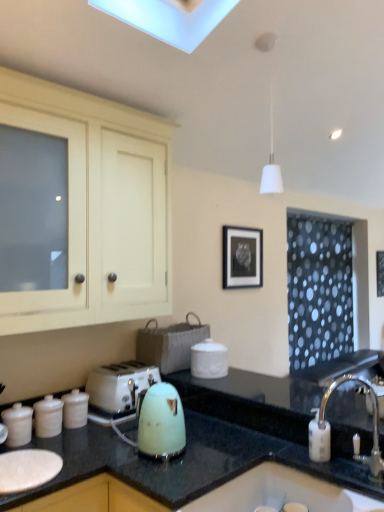
Identify the location of green glossy kettle at center. This screenshot has width=384, height=512. (221, 440).

The image size is (384, 512). Describe the element at coordinates (119, 385) in the screenshot. I see `white plastic toaster at lower left` at that location.

Locate an element on the screen. white glossy sink at lower right is located at coordinates (281, 493).

Locate an element on the screen. The width and height of the screenshot is (384, 512). matte white canister at left, which is the 1th kitchen appliance from left to right is located at coordinates (18, 424).

Find the location of a particular element. This screenshot has width=384, height=512. white glossy canisters at lower left, placed as the 2th kitchen appliance when sorted from right to left is located at coordinates (48, 417).

Describe the element at coordinates (242, 257) in the screenshot. I see `black matte picture frame at upper center` at that location.

The width and height of the screenshot is (384, 512). In order to click on silver metallic faucet at sink right in this screenshot , I will do `click(353, 437)`.

Which is in front, white glossy sink at lower right or black matte picture frame at upper center?

white glossy sink at lower right is more forward.

Where is `picture frame on the right side of white glossy sink at lower right`? This screenshot has height=512, width=384. picture frame on the right side of white glossy sink at lower right is located at coordinates (242, 257).

Is white glossy sink at lower right next to black matte picture frame at upper center and touching it?

No, white glossy sink at lower right is not beside black matte picture frame at upper center.

Which object is positioned more to the right, white glossy sink at lower right or black matte picture frame at upper center?

Positioned to the right is black matte picture frame at upper center.

Is silver metallic faucet at sink right in front of matte white canister at left, which is the 1th kitchen appliance from left to right?

Yes, the depth of silver metallic faucet at sink right is less than that of matte white canister at left, which is the 1th kitchen appliance from left to right.

Who is taller, silver metallic faucet at sink right or matte white canister at left, which is the third kitchen appliance in right-to-left order?

With more height is silver metallic faucet at sink right.

From the image's perspective, which one is positioned higher, silver metallic faucet at sink right or matte white canister at left, which is the 1th kitchen appliance from left to right?

From the image's view, silver metallic faucet at sink right is above.

Which object is positioned more to the left, green glossy kettle at center or matte white canister at left, which is the 1th kitchen appliance from left to right?

matte white canister at left, which is the 1th kitchen appliance from left to right.

Is green glossy kettle at center positioned behind matte white canister at left, which is the third kitchen appliance in right-to-left order?

No, green glossy kettle at center is in front of matte white canister at left, which is the third kitchen appliance in right-to-left order.

Could you tell me if green glossy kettle at center is turned towards matte white canister at left, which is the 1th kitchen appliance from left to right?

Yes, green glossy kettle at center is oriented towards matte white canister at left, which is the 1th kitchen appliance from left to right.

From the image's perspective, is green glossy kettle at center positioned above or below matte white canister at left, which is the third kitchen appliance in right-to-left order?

Based on their image positions, green glossy kettle at center is located beneath matte white canister at left, which is the third kitchen appliance in right-to-left order.

Which is in front, mint green plastic kettle at center, the third kitchen appliance when ordered from left to right, or green glossy kettle at center?

green glossy kettle at center is more forward.

Is mint green plastic kettle at center, the third kitchen appliance when ordered from left to right, far away from green glossy kettle at center?

No, mint green plastic kettle at center, the third kitchen appliance when ordered from left to right, is in close proximity to green glossy kettle at center.

Does point (136, 410) lie in front of point (227, 476)?

That is False.

From a real-world perspective, is mint green plastic kettle at center, the third kitchen appliance when ordered from left to right, located beneath green glossy kettle at center?

No, from a real-world perspective, mint green plastic kettle at center, the third kitchen appliance when ordered from left to right, is not below green glossy kettle at center.

From their relative heights in the image, would you say white glossy canisters at lower left, placed as the 2th kitchen appliance when sorted from right to left, is taller or shorter than silver metallic faucet at sink right?

Considering their sizes, white glossy canisters at lower left, placed as the 2th kitchen appliance when sorted from right to left, has less height than silver metallic faucet at sink right.

Considering the relative positions of matte white canister at left, which is the third kitchen appliance in right-to-left order, and matte cream cabinet at upper left in the image provided, is matte white canister at left, which is the third kitchen appliance in right-to-left order, behind matte cream cabinet at upper left?

Yes, matte white canister at left, which is the third kitchen appliance in right-to-left order, is further from the viewer.

Locate an element on the screen. cabinetry above the matte white canister at left, which is the 1th kitchen appliance from left to right (from the image's perspective) is located at coordinates (99, 207).

Which object is thinner, matte white canister at left, which is the 1th kitchen appliance from left to right, or matte cream cabinet at upper left?

matte white canister at left, which is the 1th kitchen appliance from left to right.

Does matte white canister at left, which is the third kitchen appliance in right-to-left order, have a lesser height compared to matte cream cabinet at upper left?

Yes, matte white canister at left, which is the third kitchen appliance in right-to-left order, is shorter than matte cream cabinet at upper left.

Which is nearer, (333, 383) or (145, 428)?

The point (145, 428) is closer.

Considering the sizes of objects silver metallic faucet at sink right and mint green plastic kettle at center, the third kitchen appliance when ordered from left to right, in the image provided, who is thinner, silver metallic faucet at sink right or mint green plastic kettle at center, the third kitchen appliance when ordered from left to right,?

With smaller width is mint green plastic kettle at center, the third kitchen appliance when ordered from left to right.

From a real-world perspective, is silver metallic faucet at sink right positioned under mint green plastic kettle at center, the third kitchen appliance when ordered from left to right, based on gravity?

Yes, from a real-world perspective, silver metallic faucet at sink right is below mint green plastic kettle at center, the third kitchen appliance when ordered from left to right.

Considering the sizes of objects silver metallic faucet at sink right and mint green plastic kettle at center, the 1th kitchen appliance positioned from the right, in the image provided, who is bigger, silver metallic faucet at sink right or mint green plastic kettle at center, the 1th kitchen appliance positioned from the right,?

silver metallic faucet at sink right.

At what (x,y) coordinates should I click in order to perform the action: click on sink that appears in front of the black matte picture frame at upper center. Please return your answer as a coordinate pair (x, y). Looking at the image, I should click on (281, 493).

The width and height of the screenshot is (384, 512). Identify the location of tap positioned vertically above the matte white canister at left, which is the 1th kitchen appliance from left to right (from a real-world perspective). (353, 437).

Estimate the real-world distances between objects in this image. Which object is closer to matte cream cabinet at upper left, white plastic toaster at lower left or silver metallic faucet at sink right?

The object closer to matte cream cabinet at upper left is white plastic toaster at lower left.

Looking at the image, which one is located further to matte cream cabinet at upper left, black matte picture frame at upper center or white glossy canisters at lower left, which is the 2th kitchen appliance in left-to-right order?

black matte picture frame at upper center.

Looking at the image, which one is located closer to matte white canister at left, which is the 1th kitchen appliance from left to right, black matte picture frame at upper center or white plastic toaster at lower left?

The object closer to matte white canister at left, which is the 1th kitchen appliance from left to right, is white plastic toaster at lower left.

Considering their positions, is green glossy kettle at center positioned further to black matte picture frame at upper center than white glossy canisters at lower left, which is the 2th kitchen appliance in left-to-right order?

white glossy canisters at lower left, which is the 2th kitchen appliance in left-to-right order, lies further to black matte picture frame at upper center than the other object.

Based on their spatial positions, is silver metallic faucet at sink right or green glossy kettle at center closer to matte white canister at left, which is the 1th kitchen appliance from left to right?

green glossy kettle at center is closer to matte white canister at left, which is the 1th kitchen appliance from left to right.

From the picture: Estimate the real-world distances between objects in this image. Which object is further from matte cream cabinet at upper left, silver metallic faucet at sink right or white glossy canisters at lower left, placed as the 2th kitchen appliance when sorted from right to left?

silver metallic faucet at sink right lies further to matte cream cabinet at upper left than the other object.

Estimate the real-world distances between objects in this image. Which object is further from matte cream cabinet at upper left, black matte picture frame at upper center or green glossy kettle at center?

black matte picture frame at upper center is further to matte cream cabinet at upper left.

Based on their spatial positions, is white plastic toaster at lower left or mint green plastic kettle at center, the 1th kitchen appliance positioned from the right, further from black matte picture frame at upper center?

mint green plastic kettle at center, the 1th kitchen appliance positioned from the right, is further to black matte picture frame at upper center.

At what (x,y) coordinates should I click in order to perform the action: click on toaster between matte white canister at left, which is the third kitchen appliance in right-to-left order, and white glossy sink at lower right, in the horizontal direction. Please return your answer as a coordinate pair (x, y). The image size is (384, 512). Looking at the image, I should click on (119, 385).

Image resolution: width=384 pixels, height=512 pixels. In order to click on kitchen appliance between matte cream cabinet at upper left and white plastic toaster at lower left from top to bottom in this screenshot , I will do `click(158, 422)`.

This screenshot has width=384, height=512. Identify the location of tap between white glossy sink at lower right and black matte picture frame at upper center along the z-axis. (353, 437).

Where is `countertop between white glossy canisters at lower left, which is the 2th kitchen appliance in left-to-right order, and white glossy sink at lower right`? countertop between white glossy canisters at lower left, which is the 2th kitchen appliance in left-to-right order, and white glossy sink at lower right is located at coordinates (221, 440).